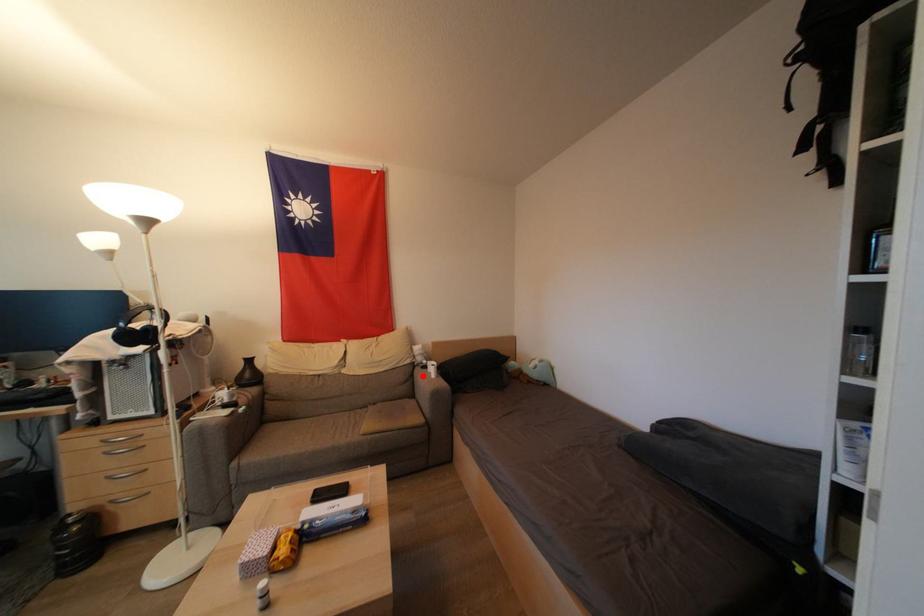
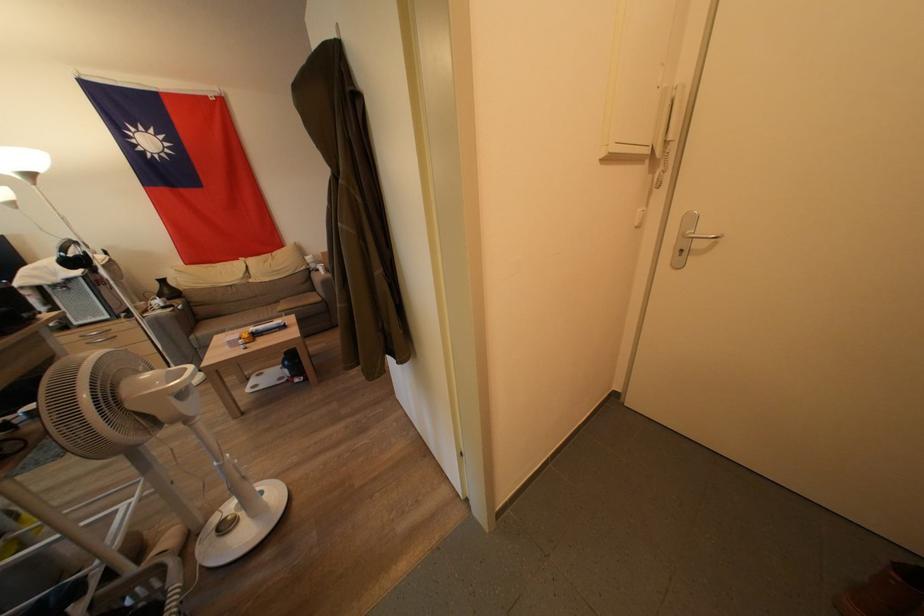
Find the pixel in the second image that matches the highlighted location in the first image.

(319, 278)